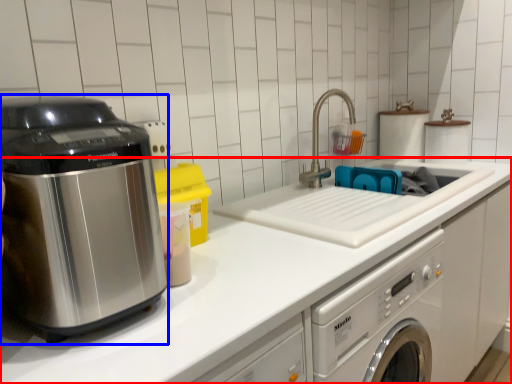
Question: Which object appears farthest to the camera in this image, countertop (highlighted by a red box) or home appliance (highlighted by a blue box)?

Choices:
 (A) countertop
 (B) home appliance

Answer: (A)